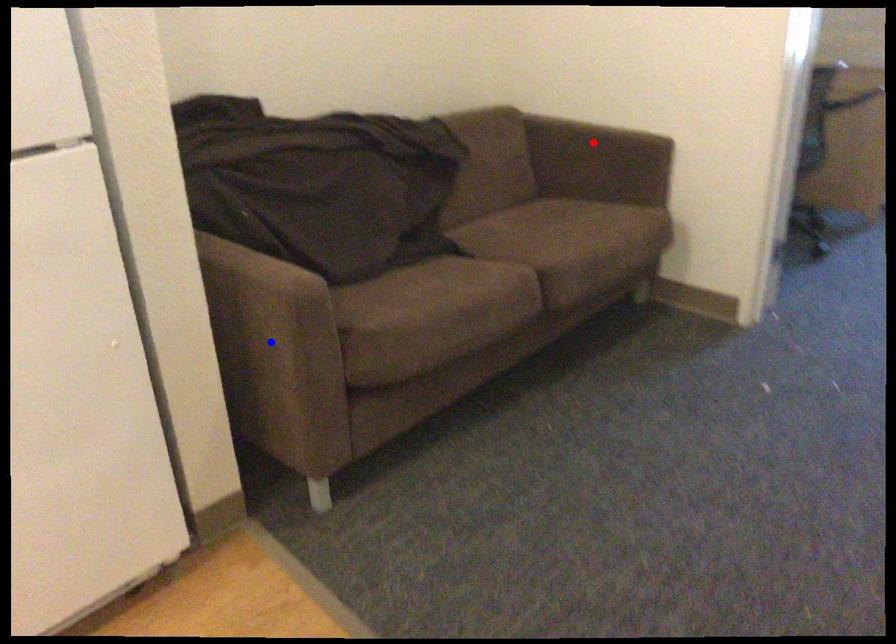
Question: Which of the two points in the image is closer to the camera?

Choices:
 (A) Blue point is closer.
 (B) Red point is closer.

Answer: (A)